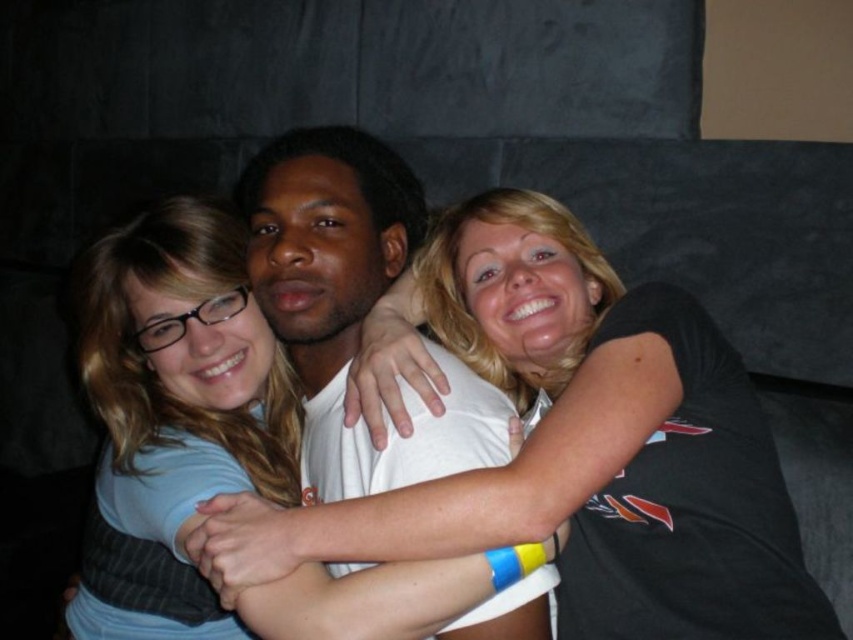
Does light blue fabric shirt at center lie in front of matte blue shirt at center?

Yes, it is in front of matte blue shirt at center.

Which is behind, point (123, 579) or point (177, 572)?

Point (123, 579)

Find the location of a particular element. light blue fabric shirt at center is located at coordinates (199, 444).

Identify the location of light blue fabric shirt at center. [199, 444].

Between point (598, 328) and point (146, 467), which one is positioned in front?

Point (598, 328)

Is point (546, 433) closer to camera compared to point (325, 621)?

No, (546, 433) is further to viewer.

Which is behind, point (641, 540) or point (259, 332)?

Point (259, 332)

Where is `black matte t-shirt at center`? This screenshot has height=640, width=853. black matte t-shirt at center is located at coordinates (585, 448).

Can you confirm if black matte t-shirt at center is bigger than matte blue shirt at center?

Yes, black matte t-shirt at center is bigger than matte blue shirt at center.

Measure the distance from black matte t-shirt at center to matte blue shirt at center.

black matte t-shirt at center is 14.07 inches away from matte blue shirt at center.

Identify the location of black matte t-shirt at center. This screenshot has height=640, width=853. (585, 448).

The height and width of the screenshot is (640, 853). What are the coordinates of `black matte t-shirt at center` in the screenshot? It's located at (585, 448).